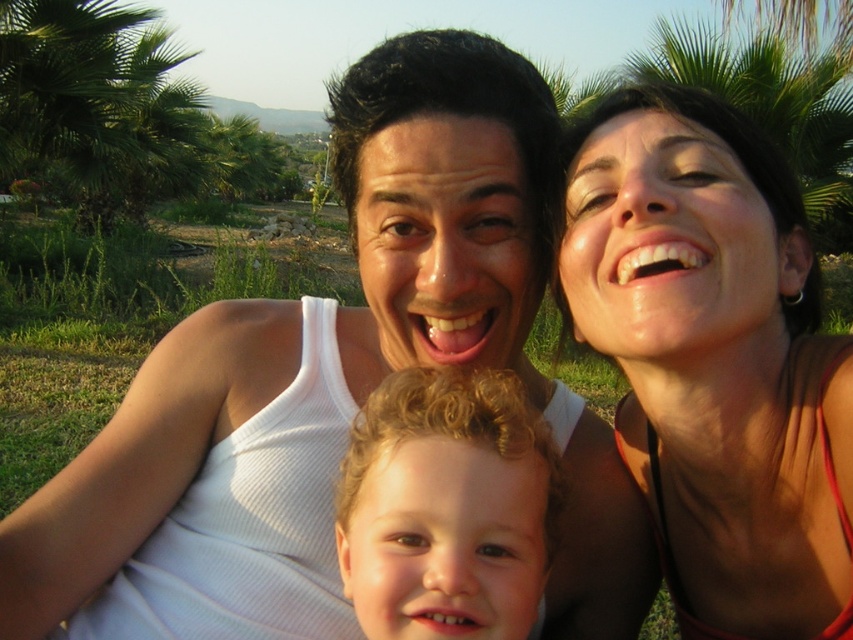
Question: Which of the following is the closest to the observer?

Choices:
 (A) curly blonde hair at center
 (B) white ribbed tank top at center

Answer: (A)

Question: Which of the following is the farthest from the observer?

Choices:
 (A) white ribbed tank top at center
 (B) curly blonde hair at center
 (C) matte red tank top at upper right

Answer: (A)

Question: Can you confirm if matte red tank top at upper right is positioned to the right of curly blonde hair at center?

Choices:
 (A) yes
 (B) no

Answer: (A)

Question: Observing the image, what is the correct spatial positioning of white ribbed tank top at center in reference to matte red tank top at upper right?

Choices:
 (A) above
 (B) below

Answer: (B)

Question: Which of the following is the farthest from the observer?

Choices:
 (A) white ribbed tank top at center
 (B) curly blonde hair at center
 (C) matte red tank top at upper right

Answer: (A)

Question: Does white ribbed tank top at center have a lesser width compared to curly blonde hair at center?

Choices:
 (A) yes
 (B) no

Answer: (B)